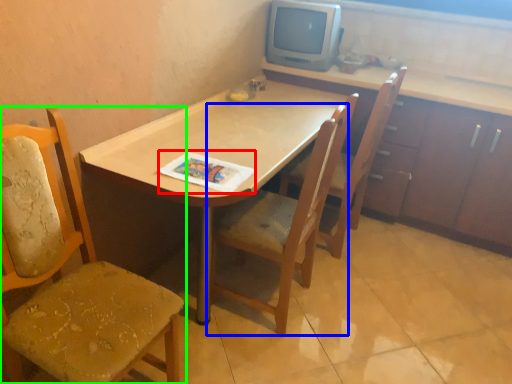
Question: Which is farther away from magazine (highlighted by a red box)? chair (highlighted by a blue box) or chair (highlighted by a green box)?

Choices:
 (A) chair
 (B) chair

Answer: (B)